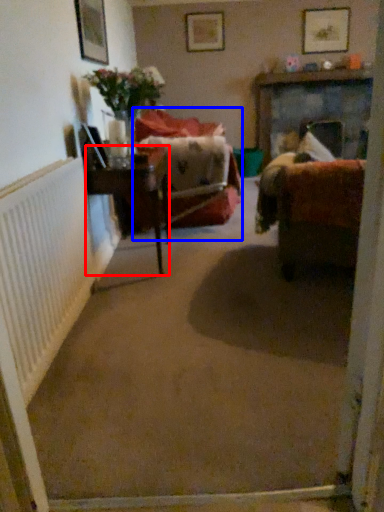
Question: Which object is closer to the camera taking this photo, table (highlighted by a red box) or chair (highlighted by a blue box)?

Choices:
 (A) table
 (B) chair

Answer: (A)